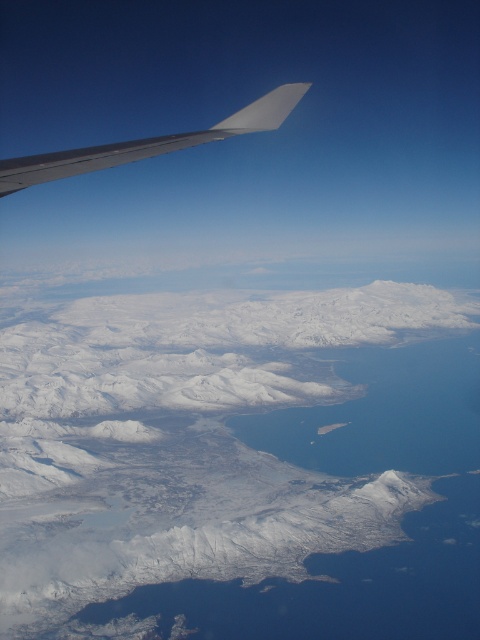
Who is positioned more to the right, white snow-covered mountains at center or metallic gray wing at upper left?

metallic gray wing at upper left

Between white snow-covered mountains at center and metallic gray wing at upper left, which one has less height?

white snow-covered mountains at center is shorter.

Looking at this image, who is more distant from viewer, (251, 401) or (255, 115)?

Point (251, 401)

This screenshot has height=640, width=480. I want to click on white snow-covered mountains at center, so click(x=183, y=444).